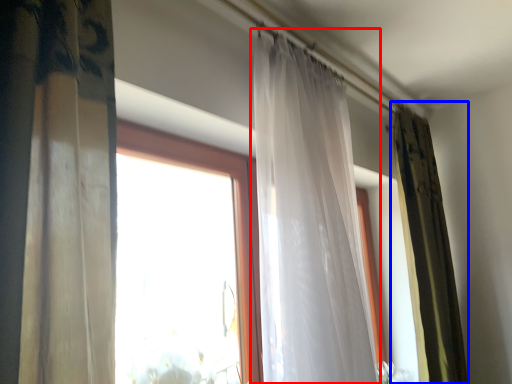
Question: Which point is closer to the camera, curtain (highlighted by a red box) or curtain (highlighted by a blue box)?

Choices:
 (A) curtain
 (B) curtain

Answer: (A)